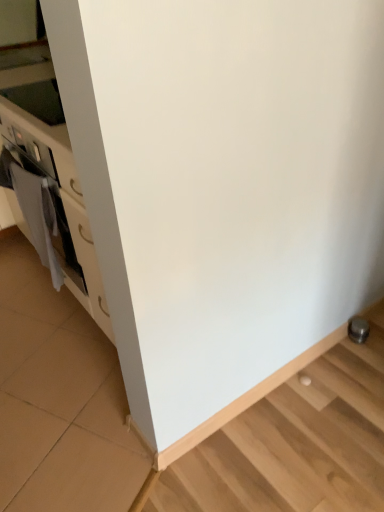
You are a GUI agent. You are given a task and a screenshot of the screen. Output one action in this format:
    pyautogui.click(x=<x>, y=<y>)
    Task: Click on the empty space that is ontop of metallic silver stairwell at lower right (from a real-world perspective)
    The width and height of the screenshot is (384, 512).
    Given the screenshot: What is the action you would take?
    click(x=292, y=358)